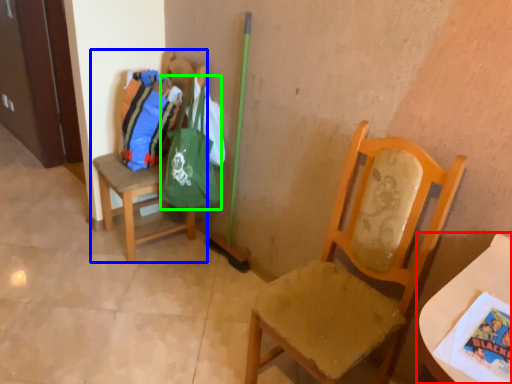
Question: Which is farther away from table (highlighted by a red box)? chair (highlighted by a blue box) or bag (highlighted by a green box)?

Choices:
 (A) chair
 (B) bag

Answer: (A)